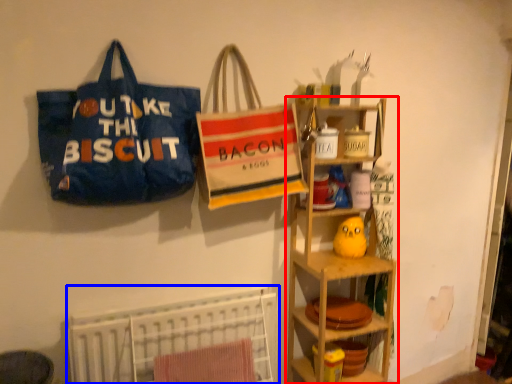
Question: Among these objects, which one is farthest to the camera, shelf (highlighted by a red box) or bed (highlighted by a blue box)?

Choices:
 (A) shelf
 (B) bed

Answer: (A)